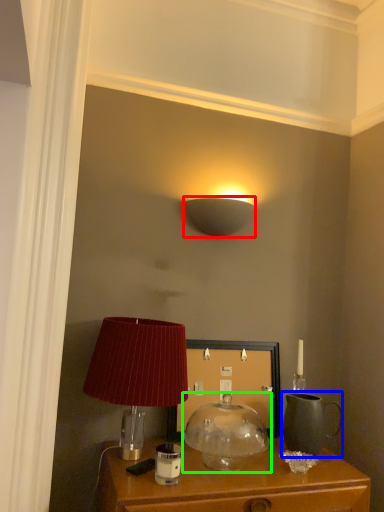
Question: Estimate the real-world distances between objects in this image. Which object is closer to lamp (highlighted by a red box), tea pot (highlighted by a blue box) or lamp (highlighted by a green box)?

Choices:
 (A) tea pot
 (B) lamp

Answer: (B)